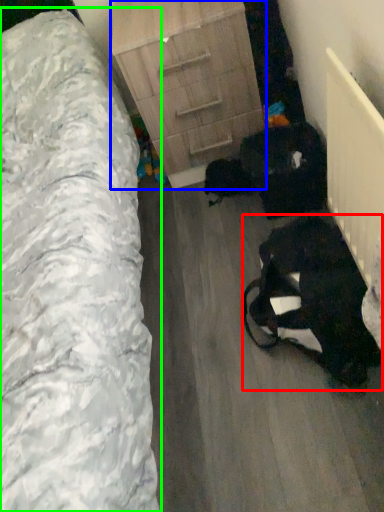
Question: Considering the real-world distances, which object is farthest from animal (highlighted by a red box)? chest of drawers (highlighted by a blue box) or furniture (highlighted by a green box)?

Choices:
 (A) chest of drawers
 (B) furniture

Answer: (A)